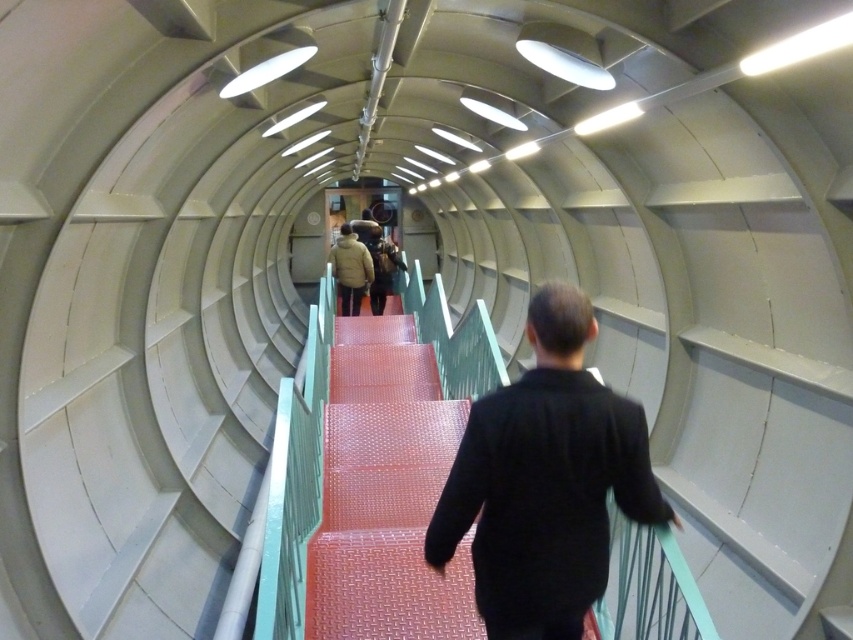
You are standing at the bottom of the tunnel steps and see the black matte jacket at center and the red textured stairs at center. Which object is closer to you?

The black matte jacket at center is closer to you because it is in front of the red textured stairs at center.

From the picture: You are standing at the bottom of the tunnel structure and see the black matte jacket at center and the red textured stairs at center. Which object is closer to you?

The black matte jacket at center is closer to you because it is located below the red textured stairs at center, which means it is positioned lower in the structure.